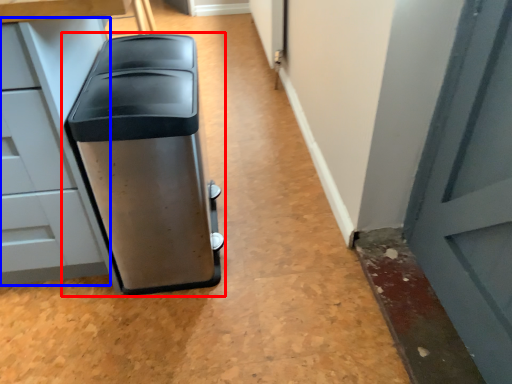
Question: Which object appears closest to the camera in this image, waste container (highlighted by a red box) or cabinetry (highlighted by a blue box)?

Choices:
 (A) waste container
 (B) cabinetry

Answer: (B)